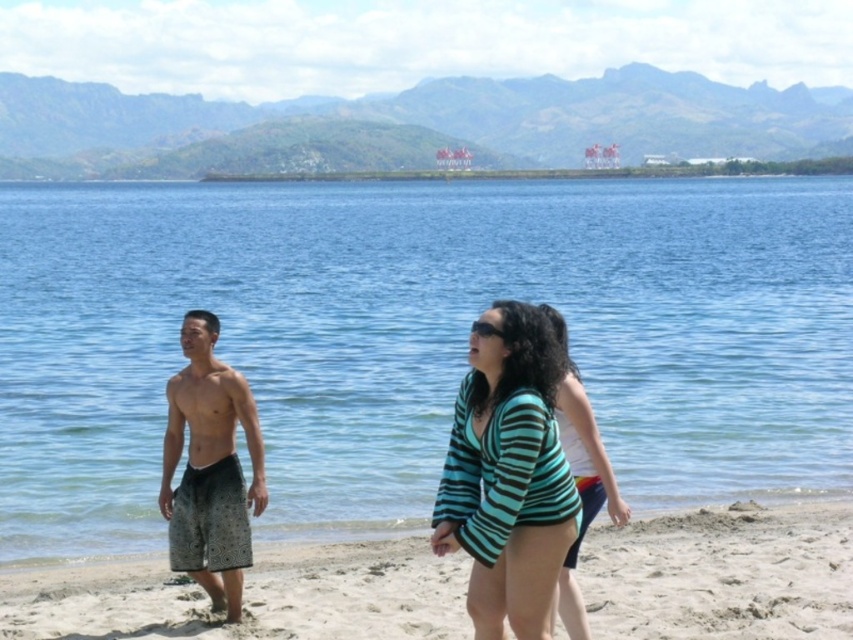
Looking at this image, you are standing at the edge of the beach and want to walk towards the teal striped sweater at center. Which direction should you move relative to the light beige sand at lower center?

You should move away from the light beige sand at lower center because the teal striped sweater at center is further away from you than the light beige sand at lower center.